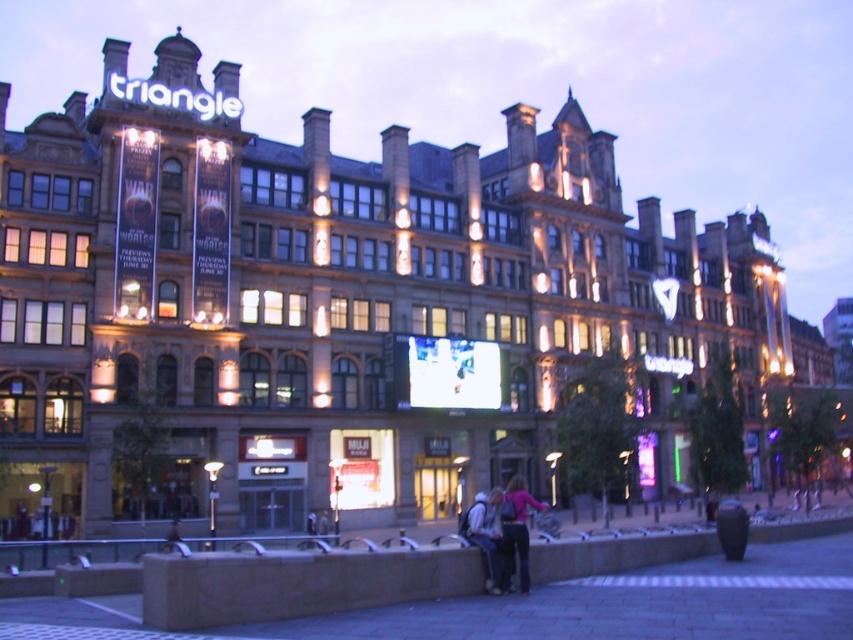
You are a fashion designer observing the scene. You notice the dark pink sweater at lower center and the denim jacket at lower center. Which clothing item has a greater horizontal span?

The dark pink sweater at lower center has a greater horizontal span than the denim jacket at lower center because its width is larger.

You are standing in front of the building and notice two points marked on its facade. The first point is located at coordinates point (x=520, y=513) and the second at point (x=495, y=576). Which of these points is closer to you?

Point (x=520, y=513) is closer to you because it is further to the viewer than point (x=495, y=576).

You are standing in front of the grand building and see the dark pink sweater at lower center. If you want to take a photo of the building without the sweater in the frame, where should you move relative to your current position?

Move to the right or left of the dark pink sweater at lower center to exclude it from the frame since its position is at coordinate point (515, 532).